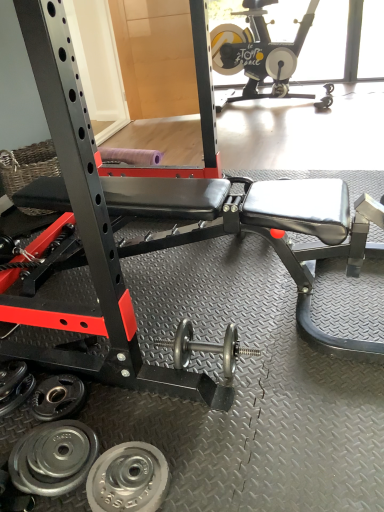
The image size is (384, 512). What are the coordinates of `vacant space to the right of silver metallic weight plate at lower left, the third wheel positioned from the back` in the screenshot? It's located at (202, 466).